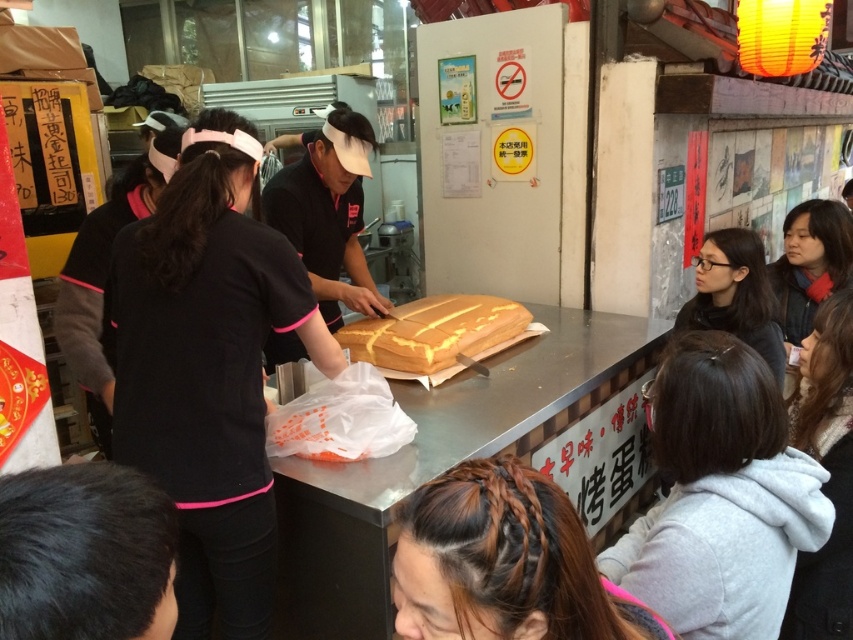
You are a customer at the food stall and want to grab the golden textured bread at center. However, there is someone with light brown hair at lower right in your way. Can you reach the bread without moving them?

The light brown hair at lower right is in front of the golden textured bread at center, so you cannot reach the bread without moving them.

You are a customer at the food stall and want to know which object is taller between the light brown hair at lower right and the golden textured bread at center. Can you tell me?

The light brown hair at lower right has a greater height compared to the golden textured bread at center, so the light brown hair at lower right is taller.

You are a customer at the food stall and want to know if you can easily reach the brown braided hair at lower center from where you are standing near the black matte uniform at center. The average person can reach up to 2 meters. Can you reach it?

The brown braided hair at lower center is 1.96 meters away from the black matte uniform at center. Since the average person can reach up to 2 meters, you can easily reach the brown braided hair at lower center from your current position.